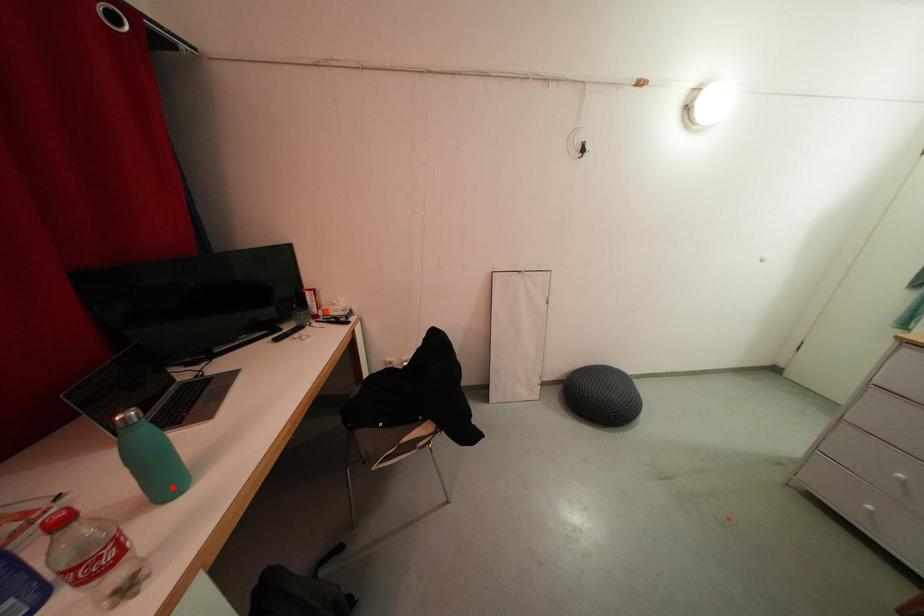
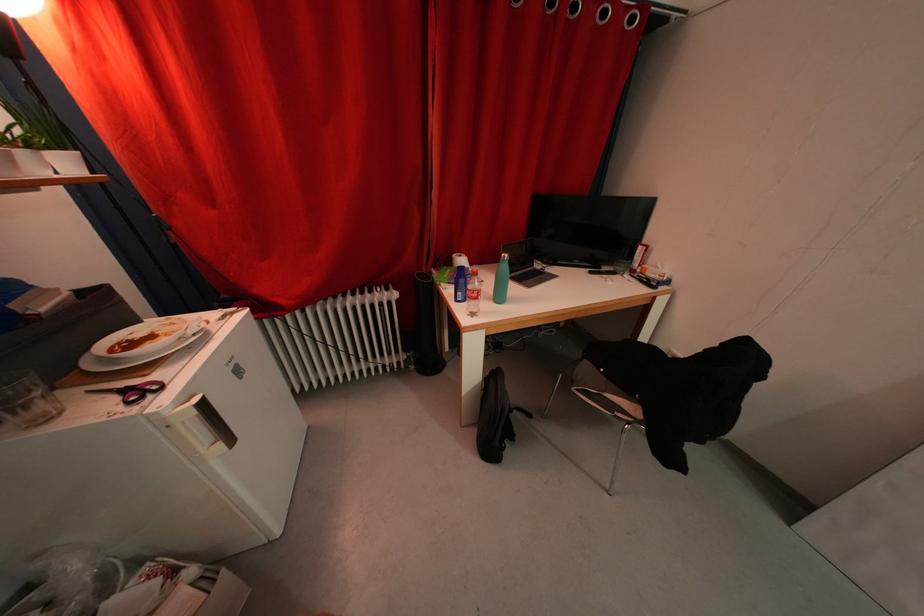
Find the pixel in the second image that matches the highlighted location in the first image.

(505, 301)